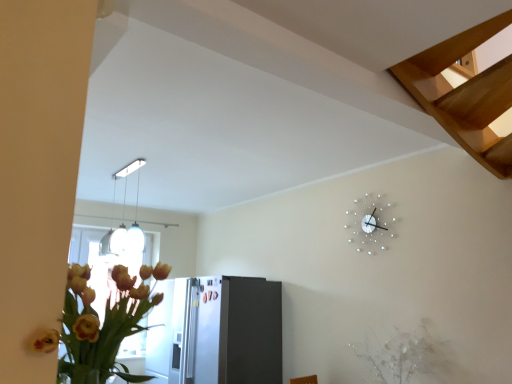
Question: From the image's perspective, is satin silver refrigerator at lower center positioned above or below white glossy pendant light at upper center?

Choices:
 (A) above
 (B) below

Answer: (B)

Question: Would you say satin silver refrigerator at lower center is inside or outside white glossy pendant light at upper center?

Choices:
 (A) outside
 (B) inside

Answer: (A)

Question: Based on their relative distances, which object is nearer to the white metallic clock at upper right?

Choices:
 (A) satin silver refrigerator at lower center
 (B) white glossy pendant light at upper center
 (C) light brown wooden stairs at upper right
 (D) white textured plant at lower right

Answer: (D)

Question: Estimate the real-world distances between objects in this image. Which object is closer to the white textured plant at lower right?

Choices:
 (A) light brown wooden stairs at upper right
 (B) white glossy pendant light at upper center
 (C) satin silver refrigerator at lower center
 (D) white metallic clock at upper right

Answer: (D)